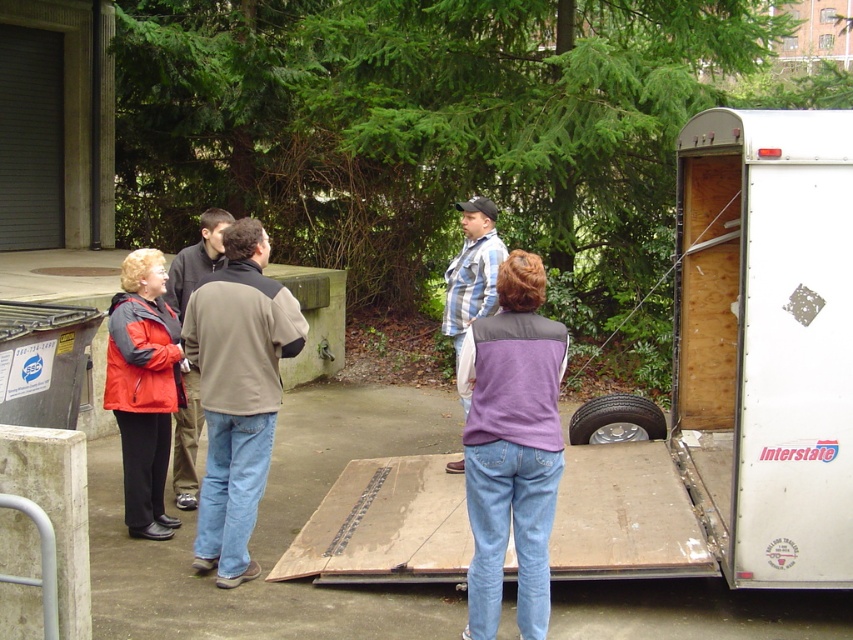
Which is in front, point (206, 544) or point (619, 401)?

Point (206, 544)

Between point (276, 406) and point (602, 435), which one is positioned behind?

Point (602, 435)

Consider the image. Measure the distance between point [241,324] and camera.

4.94 meters

Where is `brown fleece jacket at center`? The height and width of the screenshot is (640, 853). brown fleece jacket at center is located at coordinates tap(236, 392).

Is point (189, 465) behind point (618, 419)?

That is False.

Which of these two, brown leather jacket at center or black rubber tire at lower right, stands shorter?

black rubber tire at lower right is shorter.

Locate an element on the screen. The height and width of the screenshot is (640, 853). brown leather jacket at center is located at coordinates (196, 259).

I want to click on brown leather jacket at center, so click(x=196, y=259).

Is brown fleece jacket at center wider than blue striped shirt at center?

Correct, the width of brown fleece jacket at center exceeds that of blue striped shirt at center.

Which is behind, point (260, 262) or point (463, 321)?

The point (463, 321) is behind.

Where is `brown fleece jacket at center`? The image size is (853, 640). brown fleece jacket at center is located at coordinates (236, 392).